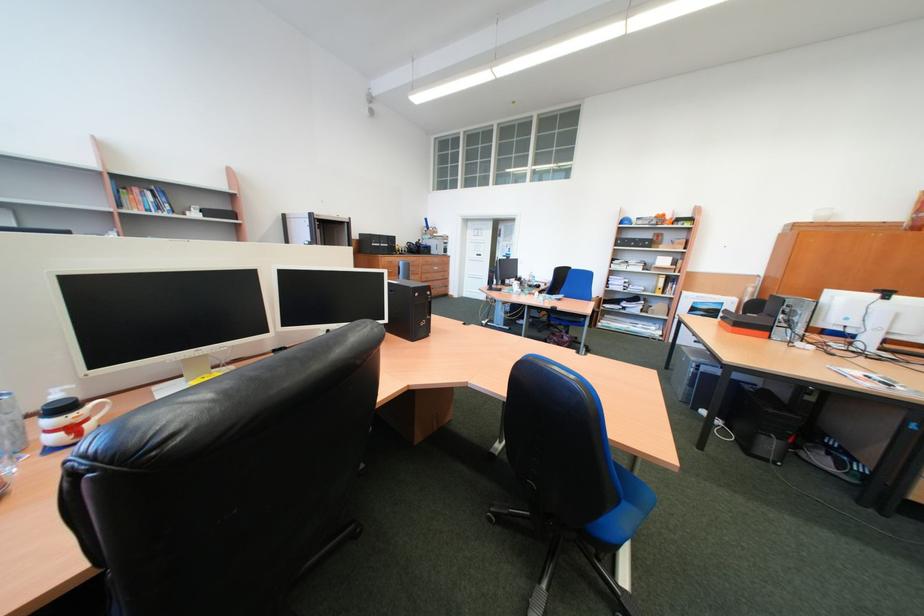
At what (x,y) coordinates should I click in order to perform the action: click on black dispenser pump. Please return your answer as a coordinate pair (x, y). This screenshot has height=616, width=924. Looking at the image, I should click on (408, 310).